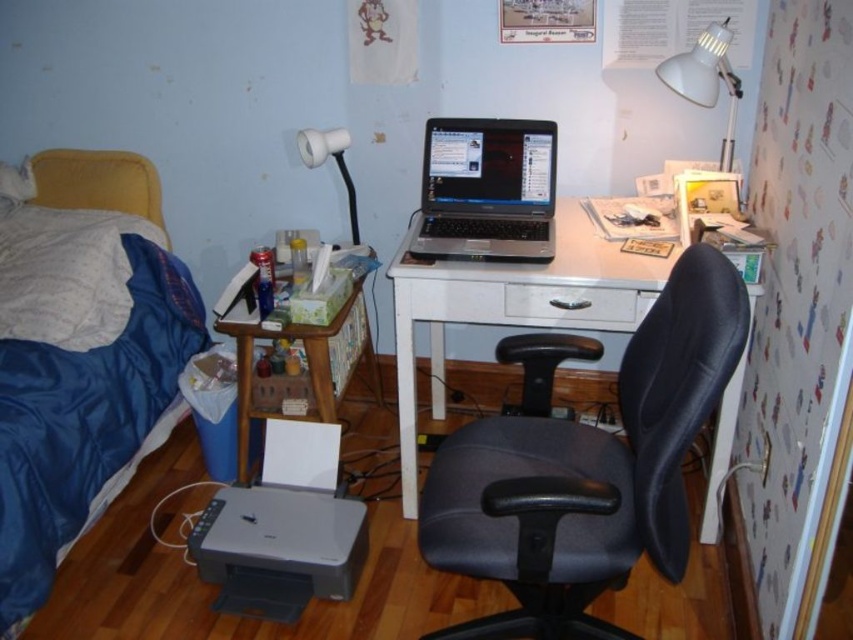
You are standing at the entrance of the room and want to move towards the desk. There is a black leather swivel chair at center and a woodenobject at left in your way. Which object is closer to the entrance?

The black leather swivel chair at center is below woodenobject at left, so the woodenobject at left is closer to the entrance.

You are standing in the middle of the room and want to move to the blue fabric bed at left. Which direction should you move in?

You should move to the left to reach the blue fabric bed at left since it is located on the left side of the room.